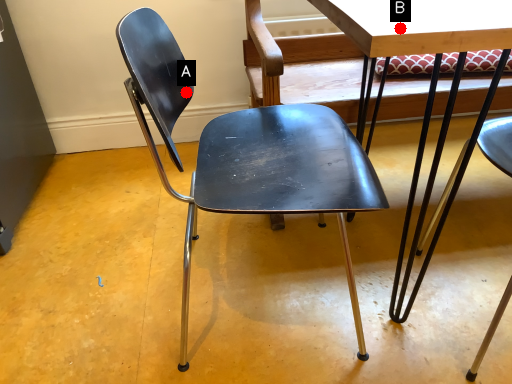
Question: Two points are circled on the image, labeled by A and B beside each circle. Which point is further to the camera?

Choices:
 (A) A is further
 (B) B is further

Answer: (A)